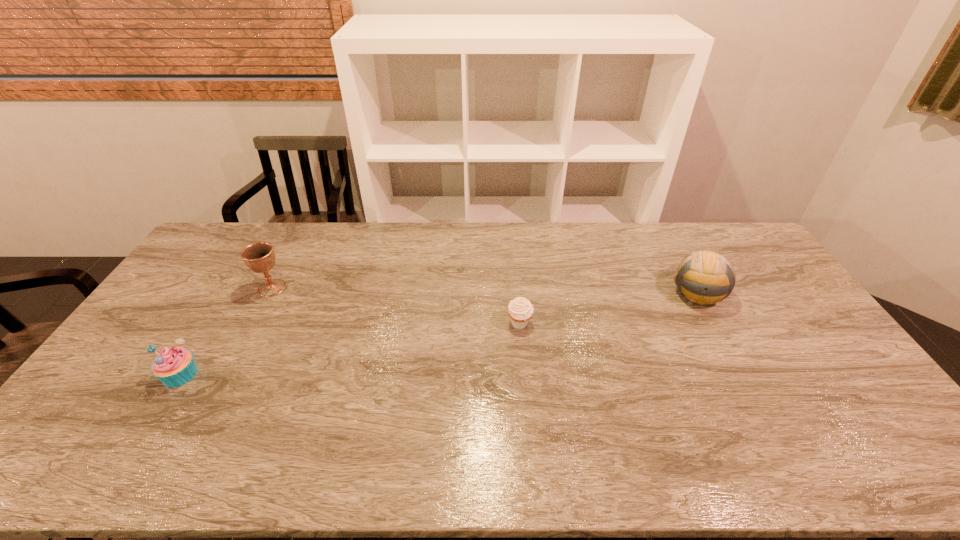
Locate an element on the screen. blank region between the chalice and the rightmost object is located at coordinates (484, 291).

You are a GUI agent. You are given a task and a screenshot of the screen. Output one action in this format:
    pyautogui.click(x=<x>, y=<y>)
    Task: Click on the empty location between the second object from right to left and the nearer muffin
    The width and height of the screenshot is (960, 540).
    Given the screenshot: What is the action you would take?
    pyautogui.click(x=350, y=349)

Find the location of a particular element. Image resolution: width=960 pixels, height=540 pixels. free spot between the right muffin and the chalice is located at coordinates (396, 306).

Image resolution: width=960 pixels, height=540 pixels. I want to click on empty space between the rightmost object and the nearer muffin, so click(439, 334).

Locate an element on the screen. The height and width of the screenshot is (540, 960). free space between the rightmost object and the third farthest object is located at coordinates (608, 309).

Identify the location of vacant space in between the nearer muffin and the farther muffin. This screenshot has width=960, height=540. (350, 349).

You are a GUI agent. You are given a task and a screenshot of the screen. Output one action in this format:
    pyautogui.click(x=<x>, y=<y>)
    Task: Click on the vacant region between the farther muffin and the third object from right to left
    The width and height of the screenshot is (960, 540).
    Given the screenshot: What is the action you would take?
    pyautogui.click(x=396, y=306)

What are the coordinates of `unoccupied position between the third object from left to right and the rightmost object` in the screenshot? It's located at (608, 309).

Identify which object is the third closest to the nearest object. Please provide its 2D coordinates. Your answer should be formatted as a tuple, i.e. [(x, y)], where the tuple contains the x and y coordinates of a point satisfying the conditions above.

[(704, 277)]

Identify which object is located as the third nearest to the third object from right to left. Please provide its 2D coordinates. Your answer should be formatted as a tuple, i.e. [(x, y)], where the tuple contains the x and y coordinates of a point satisfying the conditions above.

[(704, 277)]